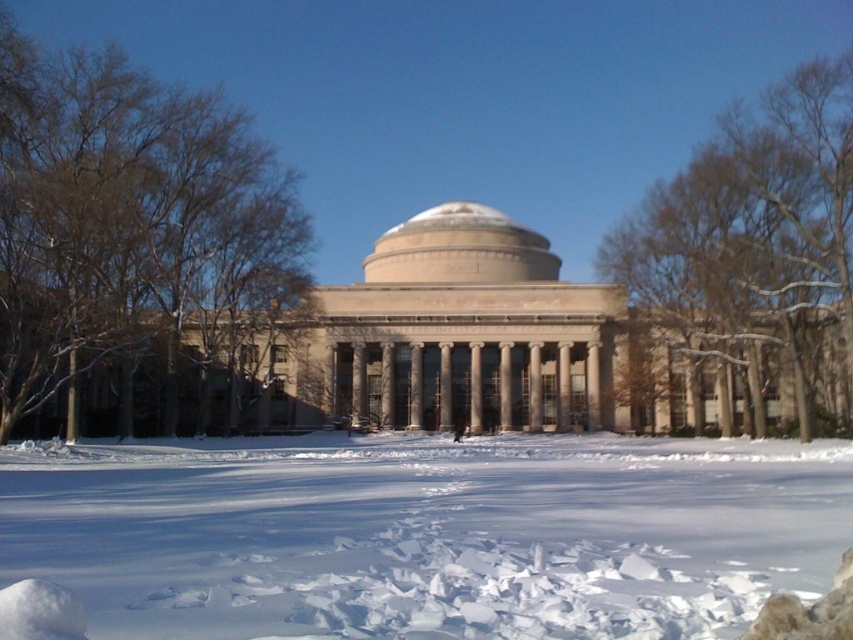
Between brown leafless tree at upper left and brown leafless tree at upper right, which one has more height?

With more height is brown leafless tree at upper left.

Does point (68, 124) come closer to viewer compared to point (743, 332)?

Yes, point (68, 124) is closer to viewer.

You are a GUI agent. You are given a task and a screenshot of the screen. Output one action in this format:
    pyautogui.click(x=<x>, y=<y>)
    Task: Click on the brown leafless tree at upper left
    The width and height of the screenshot is (853, 640).
    Given the screenshot: What is the action you would take?
    pyautogui.click(x=138, y=248)

Is the position of white powdery snow at center less distant than that of brown leafless tree at upper left?

That is True.

Is point (811, 442) more distant than point (38, 220)?

Yes.

Between point (590, 525) and point (184, 332), which one is positioned behind?

Positioned behind is point (184, 332).

This screenshot has height=640, width=853. In order to click on white powdery snow at center in this screenshot , I will do 426,534.

Does point (221, 371) come closer to viewer compared to point (498, 221)?

That is True.

From the picture: Does brown leafless tree at upper left have a larger size compared to beige stone dome at center?

Indeed, brown leafless tree at upper left has a larger size compared to beige stone dome at center.

This screenshot has height=640, width=853. I want to click on brown leafless tree at upper left, so click(138, 248).